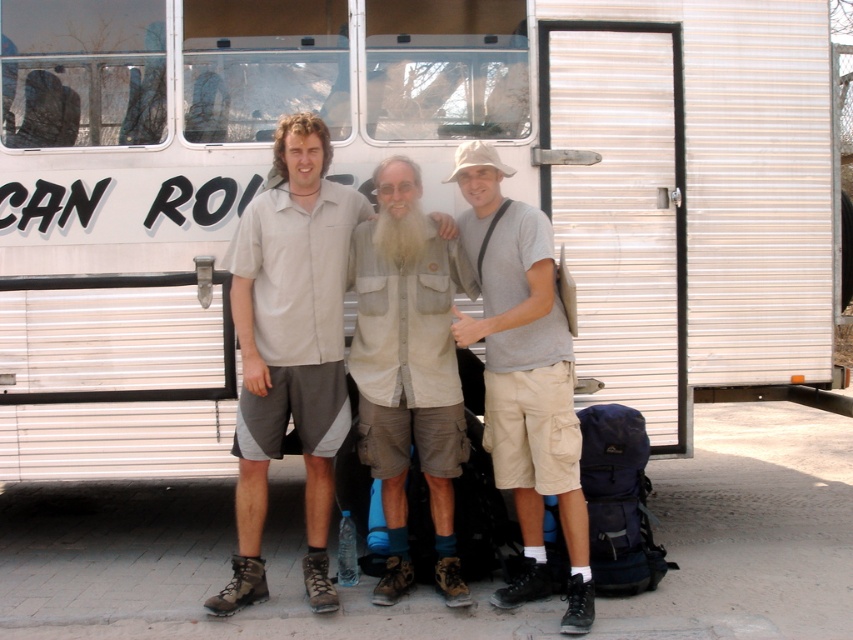
Question: Among these points, which one is farthest from the camera?

Choices:
 (A) (403, 220)
 (B) (297, 387)
 (C) (521, 516)

Answer: (C)

Question: Can you confirm if light beige shirt at center is bigger than white fluffy beard at center?

Choices:
 (A) yes
 (B) no

Answer: (A)

Question: Which point appears farthest from the camera in this image?

Choices:
 (A) (514, 237)
 (B) (396, 465)
 (C) (338, 252)

Answer: (C)

Question: Which of the following is the closest to the observer?

Choices:
 (A) light beige shirt at center
 (B) light beige fabric shirt at center
 (C) light gray cotton t-shirt at center
 (D) white fluffy beard at center

Answer: (C)

Question: Does light beige shirt at center have a greater width compared to light gray cotton t-shirt at center?

Choices:
 (A) yes
 (B) no

Answer: (A)

Question: Is light beige shirt at center positioned in front of light gray cotton t-shirt at center?

Choices:
 (A) yes
 (B) no

Answer: (B)